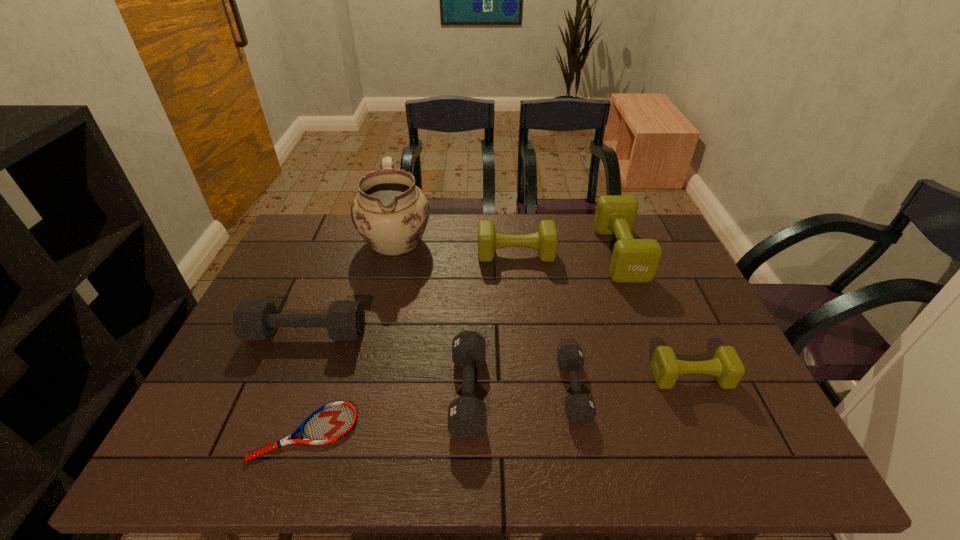
Image resolution: width=960 pixels, height=540 pixels. What are the coordinates of `vacant space in between the leftmost olive dumbbell and the seventh tallest object` in the screenshot? It's located at tap(544, 322).

The height and width of the screenshot is (540, 960). I want to click on vacant area between the tennis racket and the second smallest olive dumbbell, so click(411, 343).

Locate an element on the screen. This screenshot has width=960, height=540. object that is the second closest to the shortest object is located at coordinates (466, 415).

Find the location of a particular element. This screenshot has height=540, width=960. the closest object to the leftmost gray dumbbell is located at coordinates (331, 422).

Locate an element on the screen. Image resolution: width=960 pixels, height=540 pixels. dumbbell object that ranks as the second closest to the purple pitcher is located at coordinates (252, 319).

You are a GUI agent. You are given a task and a screenshot of the screen. Output one action in this format:
    pyautogui.click(x=<x>, y=<y>)
    Task: Click on the dumbbell that is the fourth closest to the tallest dumbbell
    
    Given the screenshot: What is the action you would take?
    pyautogui.click(x=466, y=415)

Identify which olive dumbbell is the second nearest to the blue tennis racket. Please provide its 2D coordinates. Your answer should be formatted as a tuple, i.e. [(x, y)], where the tuple contains the x and y coordinates of a point satisfying the conditions above.

[(726, 366)]

Find the location of a particular element. olive dumbbell that is the closest to the shortest dumbbell is located at coordinates click(x=726, y=366).

Identify which gray dumbbell is the nearest to the second biggest gray dumbbell. Please provide its 2D coordinates. Your answer should be formatted as a tuple, i.e. [(x, y)], where the tuple contains the x and y coordinates of a point satisfying the conditions above.

[(580, 409)]

At what (x,y) coordinates should I click in order to perform the action: click on gray dumbbell identified as the second closest to the tallest dumbbell. Please return your answer as a coordinate pair (x, y). The width and height of the screenshot is (960, 540). Looking at the image, I should click on (466, 415).